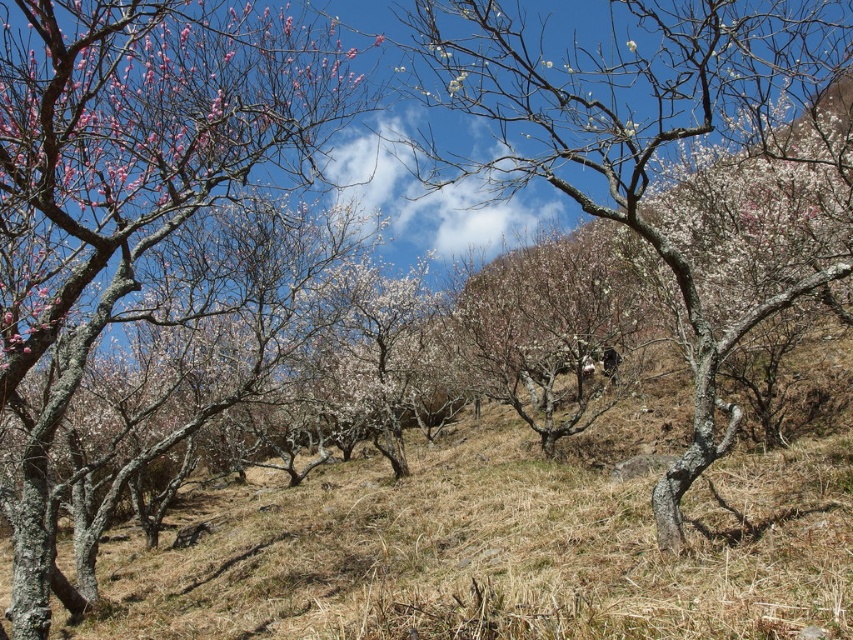
Is smooth bark tree at left to the left of white textured tree at center from the viewer's perspective?

Indeed, smooth bark tree at left is positioned on the left side of white textured tree at center.

Which is in front, point (274, 86) or point (799, 93)?

Point (799, 93)

Is point (190, 161) closer to viewer compared to point (792, 58)?

No, it is behind (792, 58).

Locate an element on the screen. smooth bark tree at left is located at coordinates point(126,179).